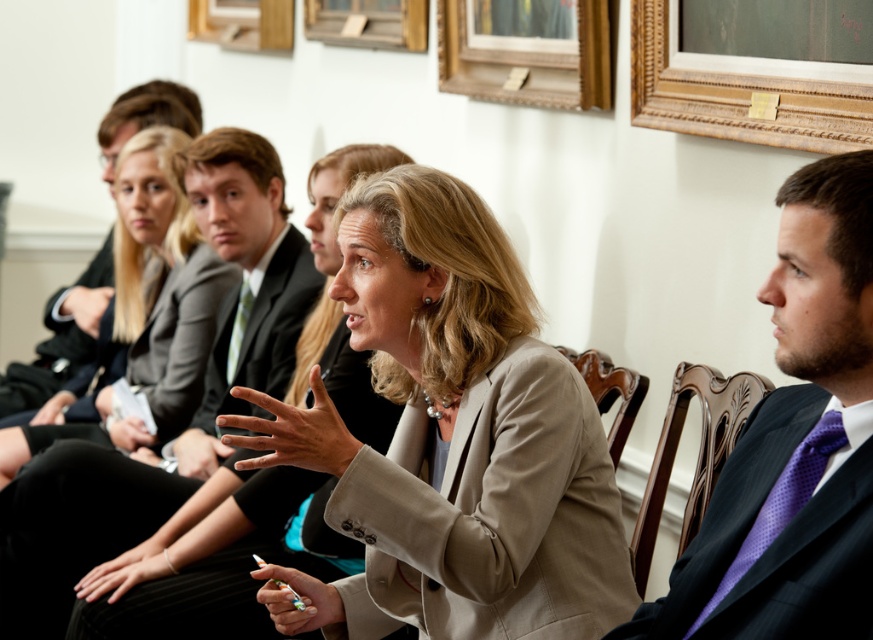
Between point (860, 186) and point (238, 317), which one is positioned behind?

The point (238, 317) is more distant.

Is dark blue suit at center wider than green silk tie at center?

Correct, the width of dark blue suit at center exceeds that of green silk tie at center.

Between point (871, 150) and point (246, 323), which one is positioned in front?

Point (871, 150) is in front.

Locate an element on the screen. dark blue suit at center is located at coordinates (795, 444).

Between mahogany wood chair at right and wooden frame at upper center, which one has more height?

Standing taller between the two is mahogany wood chair at right.

Looking at this image, can you confirm if mahogany wood chair at right is shorter than wooden frame at upper center?

In fact, mahogany wood chair at right may be taller than wooden frame at upper center.

The width and height of the screenshot is (873, 640). What do you see at coordinates (698, 454) in the screenshot?
I see `mahogany wood chair at right` at bounding box center [698, 454].

Locate an element on the screen. mahogany wood chair at right is located at coordinates (698, 454).

Which is more to the right, mahogany wood chair at right or black fabric business suit at center?

mahogany wood chair at right

Which is behind, point (681, 404) or point (23, 397)?

Positioned behind is point (23, 397).

Describe the element at coordinates (698, 454) in the screenshot. The image size is (873, 640). I see `mahogany wood chair at right` at that location.

Where is `mahogany wood chair at right`? mahogany wood chair at right is located at coordinates (698, 454).